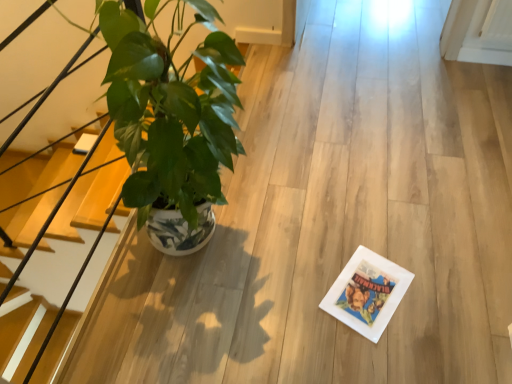
What are the coordinates of `free point below wooden at left (from a real-world perspective)` in the screenshot? It's located at (99, 330).